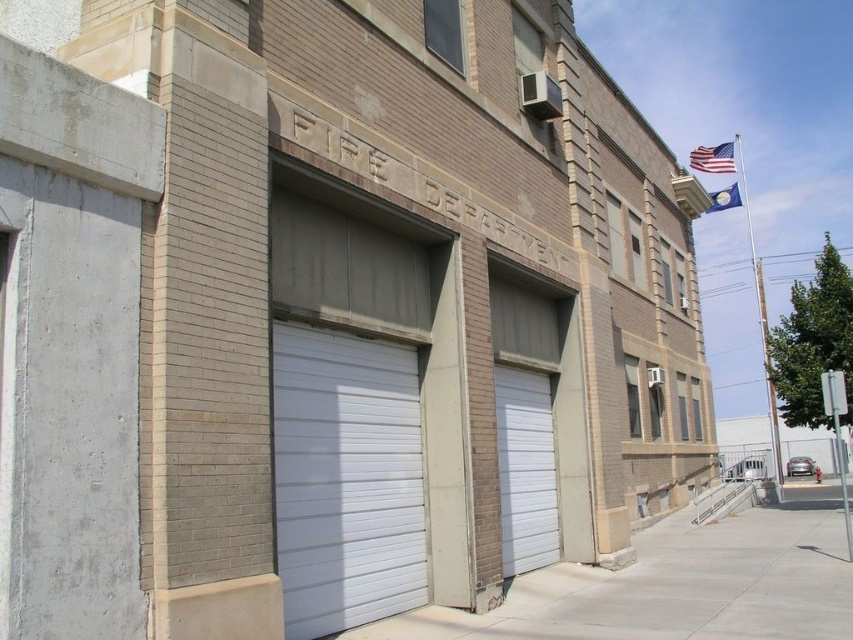
Question: Is white metallic garage door at center bigger than white smooth garage door at center?

Choices:
 (A) no
 (B) yes

Answer: (B)

Question: Which object appears closest to the camera in this image?

Choices:
 (A) blue fabric flag at upper right
 (B) white smooth garage door at center

Answer: (B)

Question: Which of the following is the closest to the observer?

Choices:
 (A) white metallic garage door at center
 (B) american flag at upper right
 (C) blue fabric flag at upper right

Answer: (A)

Question: Which point is closer to the camera?

Choices:
 (A) white metallic garage door at center
 (B) blue fabric flag at upper right
 (C) american flag at upper right
 (D) white smooth garage door at center

Answer: (A)

Question: Is american flag at upper right above blue fabric flag at upper right?

Choices:
 (A) no
 (B) yes

Answer: (B)

Question: Can you confirm if white smooth garage door at center is smaller than blue fabric flag at upper right?

Choices:
 (A) no
 (B) yes

Answer: (B)